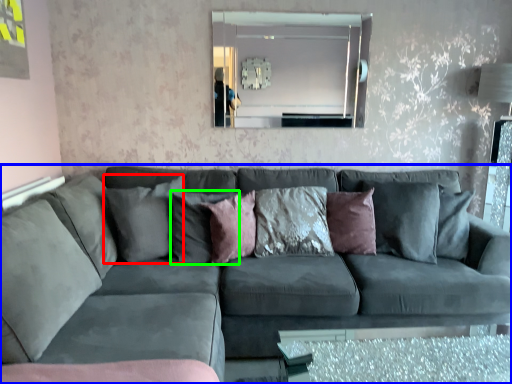
Question: Which object is positioned farthest from pillow (highlighted by a red box)? Select from studio couch (highlighted by a blue box) and pillow (highlighted by a green box).

Choices:
 (A) studio couch
 (B) pillow

Answer: (A)